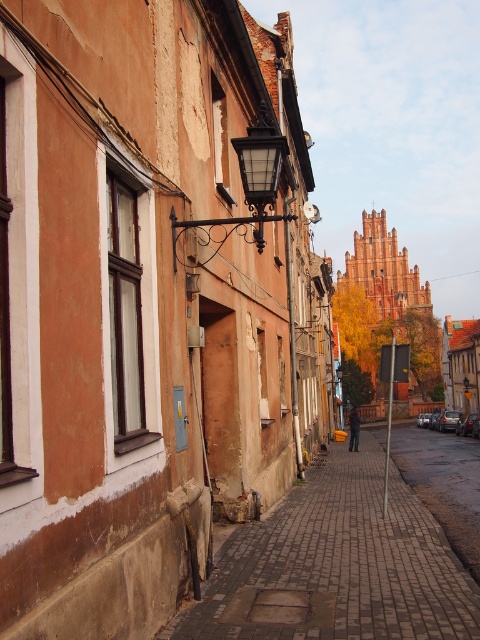
Is brick paved sidewalk at center to the left of brick sidewalk at center from the viewer's perspective?

Yes, brick paved sidewalk at center is to the left of brick sidewalk at center.

Which is in front, point (433, 618) or point (453, 531)?

Point (433, 618) is in front.

Is point (331, 484) closer to viewer compared to point (432, 504)?

No, (331, 484) is behind (432, 504).

The height and width of the screenshot is (640, 480). I want to click on brick paved sidewalk at center, so point(357,547).